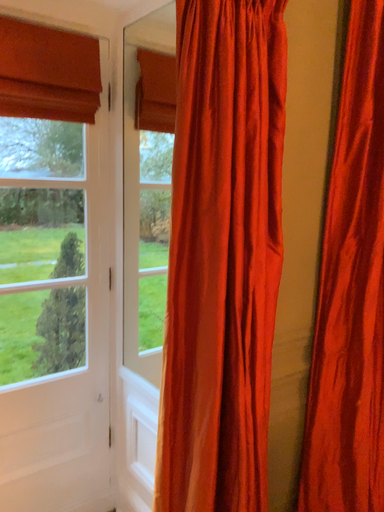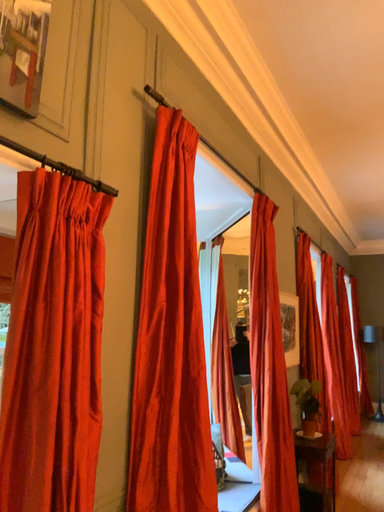
Question: Which way did the camera rotate in the video?

Choices:
 (A) rotated downward
 (B) rotated upward

Answer: (B)